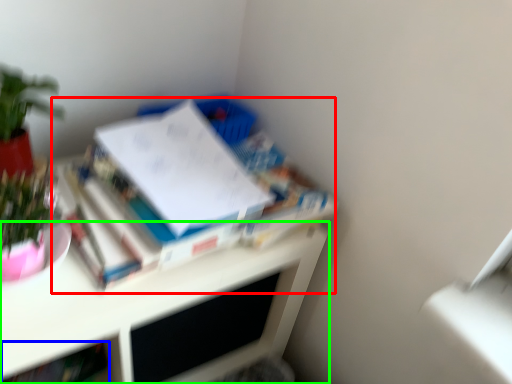
Question: Which object is positioned farthest from book (highlighted by a red box)? Select from book (highlighted by a blue box) and desk (highlighted by a green box).

Choices:
 (A) book
 (B) desk

Answer: (A)